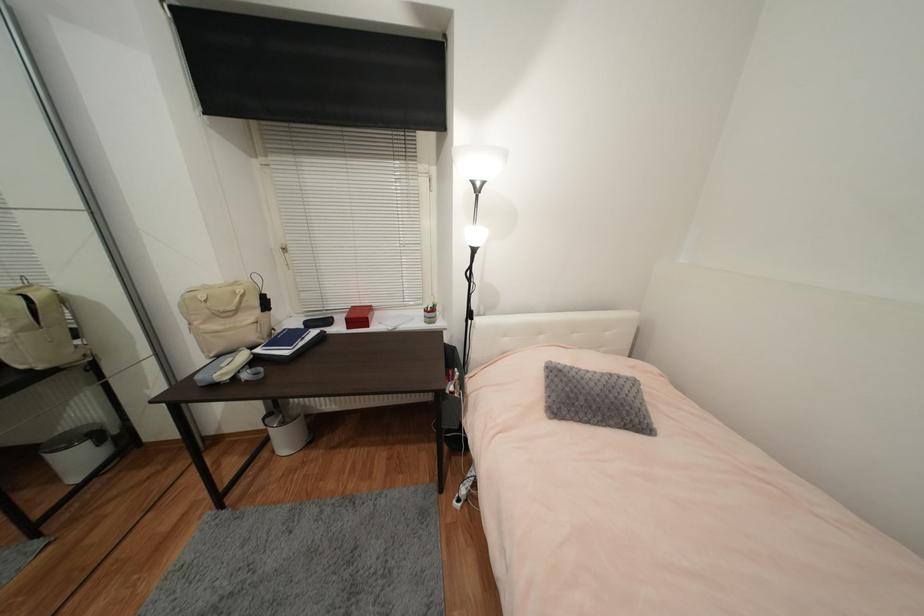
The width and height of the screenshot is (924, 616). Identify the location of blind pull cord. (204, 132).